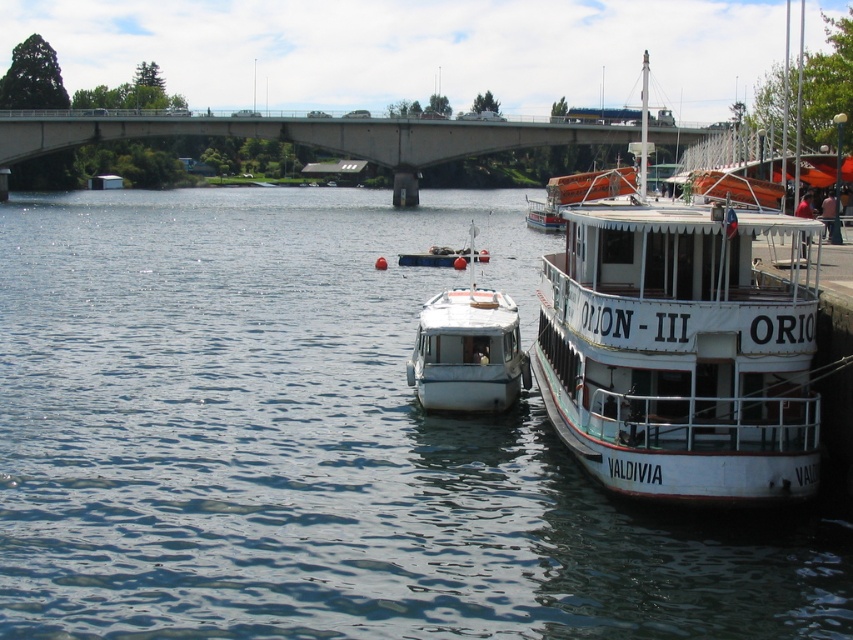
Question: Which point is closer to the camera?

Choices:
 (A) white wooden boat at right
 (B) concrete bridge at upper center

Answer: (A)

Question: Which object is closer to the camera taking this photo?

Choices:
 (A) clear blue water at center
 (B) concrete bridge at upper center

Answer: (A)

Question: In this image, where is clear blue water at center located relative to orange rubber lifeboat at upper right?

Choices:
 (A) right
 (B) left

Answer: (B)

Question: Does white glossy boat at center have a lesser width compared to orange rubber lifeboat at upper right?

Choices:
 (A) no
 (B) yes

Answer: (B)

Question: Which point is farther to the camera?

Choices:
 (A) white wooden boat at right
 (B) clear blue water at center
 (C) orange rubber lifeboat at upper right

Answer: (C)

Question: From the image, what is the correct spatial relationship of concrete bridge at upper center in relation to orange rubber lifeboat at upper right?

Choices:
 (A) above
 (B) below

Answer: (A)